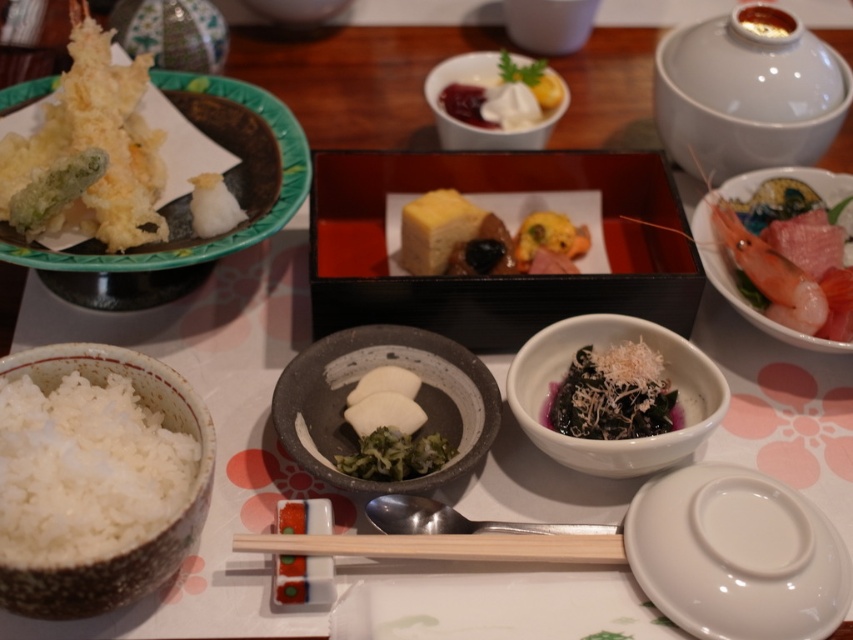
Is point (498, 272) closer to camera compared to point (386, 365)?

No, it is behind (386, 365).

Is point (393, 228) behind point (399, 480)?

Yes, it is.

Identify the location of yellow cheese at center. This screenshot has width=853, height=640. (496, 230).

Does matte gray bowl at center have a greater width compared to dark green leafy vegetable with shredded topping at center?

Indeed, matte gray bowl at center has a greater width compared to dark green leafy vegetable with shredded topping at center.

Does point (440, 394) lie in front of point (660, 365)?

No, it is not.

Which is in front, point (453, 368) or point (656, 369)?

Point (656, 369) is more forward.

Find the location of a particular element. The height and width of the screenshot is (640, 853). matte gray bowl at center is located at coordinates (415, 401).

Is matte gray bowl at center wider than yellow cheese at center?

Incorrect, matte gray bowl at center's width does not surpass yellow cheese at center's.

Does point (444, 474) come closer to viewer compared to point (486, 216)?

Yes.

The image size is (853, 640). In order to click on matte gray bowl at center in this screenshot , I will do `click(415, 401)`.